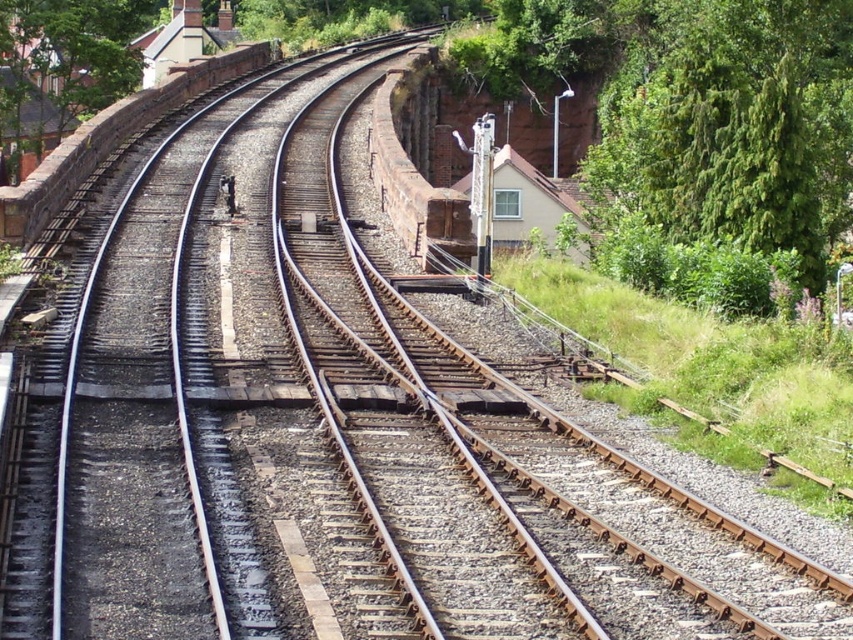
You are standing at the center of the railway tracks and looking towards the direction of the tracks. Which direction should you turn to face the green leafy tree at right?

The green leafy tree at right is located at point coordinates of 0.195 on the x axis and 0.858 on the y axis. Since the tracks are laid out in a straight line from the center, turning to your right would align you with the direction of the tree.

You are standing at the point marked as point (730, 124) in the image. Looking around, you see a green leafy tree at right. Where is the green leafy tree located relative to your position?

The green leafy tree at right is located to the right side of point (730, 124).